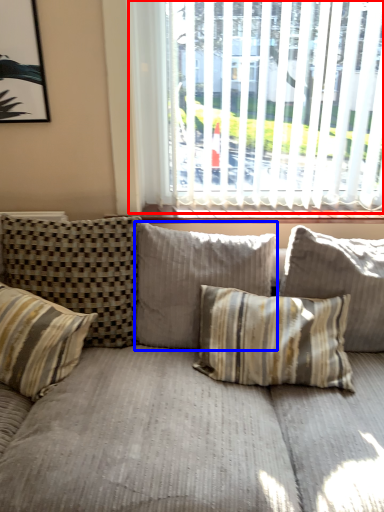
Question: Which point is further to the camera, window (highlighted by a red box) or pillow (highlighted by a blue box)?

Choices:
 (A) window
 (B) pillow

Answer: (A)